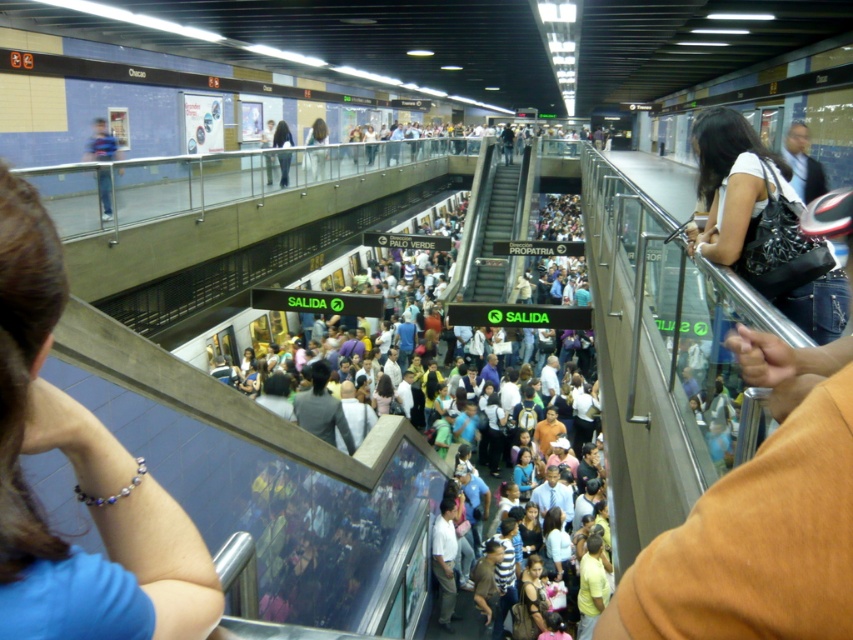
Where is `multicolored fabric crowd at center`? The width and height of the screenshot is (853, 640). multicolored fabric crowd at center is located at coordinates (335, 547).

Does multicolored fabric crowd at center have a greater height compared to matte black purse at upper right?

Yes.

Locate an element on the screen. multicolored fabric crowd at center is located at coordinates (335, 547).

Is point (4, 227) in front of point (500, 234)?

Yes.

The width and height of the screenshot is (853, 640). What do you see at coordinates (78, 477) in the screenshot?
I see `blue fabric bracelet at upper left` at bounding box center [78, 477].

Between point (18, 467) and point (496, 234), which one is positioned in front?

Point (18, 467) is in front.

I want to click on blue fabric bracelet at upper left, so click(x=78, y=477).

How far apart are matte black purse at upper right and metallic escalator at center?

matte black purse at upper right and metallic escalator at center are 79.07 feet apart from each other.

Does point (735, 115) come farther from viewer compared to point (497, 177)?

No.

The image size is (853, 640). What are the coordinates of `matte black purse at upper right` in the screenshot? It's located at (732, 180).